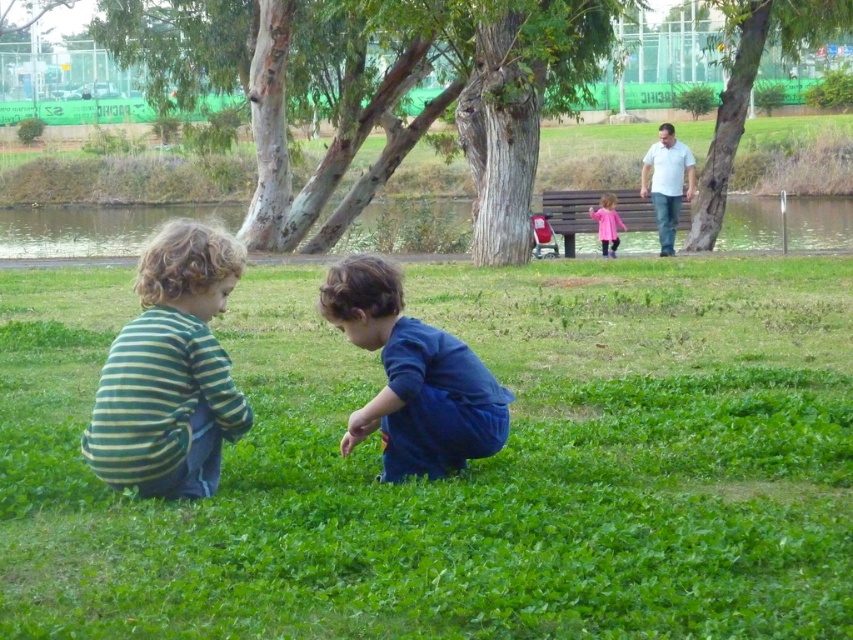
Is green soft grass at center smaller than green striped shirt at left?

No.

Can you confirm if green soft grass at center is shorter than green striped shirt at left?

No.

Consider the image. Who is more forward, (838, 561) or (183, 497)?

Positioned in front is point (838, 561).

You are a GUI agent. You are given a task and a screenshot of the screen. Output one action in this format:
    pyautogui.click(x=<x>, y=<y>)
    Task: Click on the green soft grass at center
    
    Given the screenshot: What is the action you would take?
    pyautogui.click(x=465, y=472)

Does dark blue fabric at center appear on the left side of pink fabric dress at center?

Indeed, dark blue fabric at center is positioned on the left side of pink fabric dress at center.

Does dark blue fabric at center come in front of pink fabric dress at center?

Yes.

Between point (387, 422) and point (616, 237), which one is positioned in front?

Positioned in front is point (387, 422).

The width and height of the screenshot is (853, 640). Identify the location of dark blue fabric at center. (413, 378).

Does green soft grass at center have a smaller size compared to white cotton shirt at upper right?

Actually, green soft grass at center might be larger than white cotton shirt at upper right.

Does green soft grass at center come behind white cotton shirt at upper right?

That is False.

Who is more distant from viewer, (161, 552) or (664, 148)?

Positioned behind is point (664, 148).

Identify the location of green soft grass at center. (465, 472).